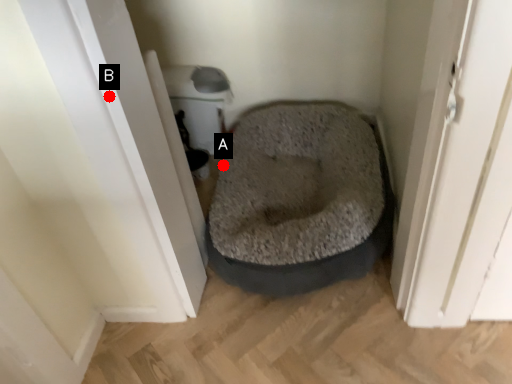
Question: Two points are circled on the image, labeled by A and B beside each circle. Which point is farther to the camera?

Choices:
 (A) A is further
 (B) B is further

Answer: (A)